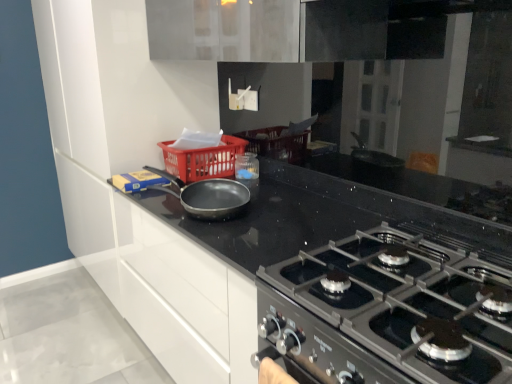
This screenshot has height=384, width=512. Describe the element at coordinates (389, 311) in the screenshot. I see `black matte gas stove at center` at that location.

Describe the element at coordinates (334, 280) in the screenshot. I see `black granite countertop at center` at that location.

Image resolution: width=512 pixels, height=384 pixels. Find the location of `black matte gas stove at center`. black matte gas stove at center is located at coordinates (389, 311).

Between plastic basket at center and black granite countertop at center, which one has more height?

black granite countertop at center.

Considering the points (226, 139) and (178, 204), which point is in front, point (226, 139) or point (178, 204)?

The point (178, 204) is closer.

Is plastic basket at center turned away from black granite countertop at center?

No.

Is black granite countertop at center taller than black matte gas stove at center?

Correct, black granite countertop at center is much taller as black matte gas stove at center.

Considering the points (401, 289) and (382, 331), which point is in front, point (401, 289) or point (382, 331)?

The point (382, 331) is in front.

What's the angular difference between black granite countertop at center and black matte gas stove at center's facing directions?

1.64 degrees.

From a real-world perspective, between black granite countertop at center and black matte gas stove at center, who is vertically lower?

black granite countertop at center, from a real-world perspective.

Is black matte gas stove at center oriented away from black granite countertop at center?

No, black matte gas stove at center's orientation is not away from black granite countertop at center.

Which point is more forward, (x=488, y=298) or (x=255, y=274)?

The point (x=488, y=298) is closer to the camera.

Is black matte gas stove at center shorter than black granite countertop at center?

Yes.

Considering the positions of points (173, 150) and (220, 191), is point (173, 150) farther from camera compared to point (220, 191)?

Yes, it is.

The width and height of the screenshot is (512, 384). I want to click on basket behind the matte black frying pan at center, so click(203, 160).

Consider the image. Is plastic basket at center shorter than matte black frying pan at center?

In fact, plastic basket at center may be taller than matte black frying pan at center.

From the image's perspective, is plastic basket at center located beneath matte black frying pan at center?

No.

Are black matte gas stove at center and matte black frying pan at center far apart?

black matte gas stove at center is actually quite close to matte black frying pan at center.

From a real-world perspective, who is located higher, black matte gas stove at center or matte black frying pan at center?

matte black frying pan at center.

From the image's perspective, is black matte gas stove at center located beneath matte black frying pan at center?

Yes, from the image's perspective, black matte gas stove at center is beneath matte black frying pan at center.

Between black matte gas stove at center and plastic basket at center, which one has less height?

With less height is plastic basket at center.

Which object is further away from the camera taking this photo, black matte gas stove at center or plastic basket at center?

plastic basket at center is further away from the camera.

Could you tell me if black matte gas stove at center is turned towards plastic basket at center?

No, black matte gas stove at center is not turned towards plastic basket at center.

Is black matte gas stove at center wider than plastic basket at center?

Indeed, black matte gas stove at center has a greater width compared to plastic basket at center.

Would you consider black granite countertop at center to be distant from plastic basket at center?

No, black granite countertop at center is not far from plastic basket at center.

Is black granite countertop at center in front of or behind plastic basket at center in the image?

Visually, black granite countertop at center is located in front of plastic basket at center.

Image resolution: width=512 pixels, height=384 pixels. What are the coordinates of `countertop located underneath the plastic basket at center (from a real-world perspective)` in the screenshot? It's located at (334, 280).

Considering the relative sizes of black granite countertop at center and plastic basket at center in the image provided, is black granite countertop at center taller than plastic basket at center?

Yes.

Find the location of a particular element. This screenshot has height=384, width=512. basket to the left of black granite countertop at center is located at coordinates (203, 160).

This screenshot has width=512, height=384. I want to click on countertop behind the black matte gas stove at center, so click(334, 280).

Based on their spatial positions, is matte black frying pan at center or black matte gas stove at center further from plastic basket at center?

black matte gas stove at center lies further to plastic basket at center than the other object.

From the image, which object appears to be farther from plastic basket at center, matte black frying pan at center or black granite countertop at center?

Based on the image, black granite countertop at center appears to be further to plastic basket at center.

Based on their spatial positions, is black matte gas stove at center or black granite countertop at center further from matte black frying pan at center?

black matte gas stove at center lies further to matte black frying pan at center than the other object.

Looking at the image, which one is located closer to black granite countertop at center, black matte gas stove at center or plastic basket at center?

black matte gas stove at center lies closer to black granite countertop at center than the other object.

When comparing their distances from matte black frying pan at center, does plastic basket at center or black granite countertop at center seem further?

black granite countertop at center.

Considering their positions, is matte black frying pan at center positioned further to black matte gas stove at center than plastic basket at center?

plastic basket at center is further to black matte gas stove at center.

In the scene shown: Which object lies nearer to the anchor point black granite countertop at center, matte black frying pan at center or plastic basket at center?

matte black frying pan at center.

When comparing their distances from black matte gas stove at center, does plastic basket at center or matte black frying pan at center seem closer?

Based on the image, matte black frying pan at center appears to be nearer to black matte gas stove at center.

The image size is (512, 384). I want to click on kitchen appliance between black matte gas stove at center and plastic basket at center in the front-back direction, so click(x=207, y=196).

This screenshot has height=384, width=512. I want to click on countertop between black matte gas stove at center and matte black frying pan at center from front to back, so click(334, 280).

Find the location of a particular element. countertop located between black matte gas stove at center and plastic basket at center in the depth direction is located at coordinates [334, 280].

Where is `kitchen appliance positioned between black granite countertop at center and plastic basket at center from near to far`? kitchen appliance positioned between black granite countertop at center and plastic basket at center from near to far is located at coordinates (207, 196).